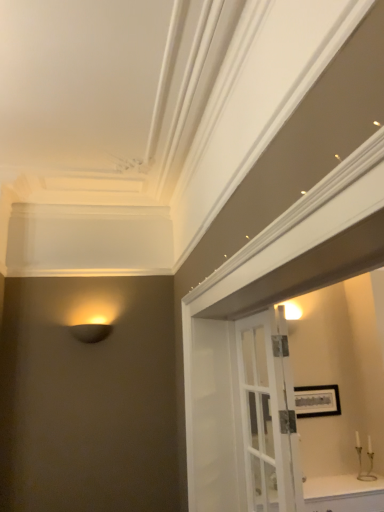
In order to face white glossy cabinet at lower right, should I rotate leftwards or rightwards?

It's best to rotate right around 20.385 degrees.

The height and width of the screenshot is (512, 384). What do you see at coordinates (369, 459) in the screenshot? I see `metallic gold candle holder at lower right` at bounding box center [369, 459].

This screenshot has width=384, height=512. What do you see at coordinates (268, 413) in the screenshot? I see `white glass door at center` at bounding box center [268, 413].

You are a GUI agent. You are given a task and a screenshot of the screen. Output one action in this format:
    pyautogui.click(x=<x>, y=<y>)
    Task: Click on the matte black lamp at left
    
    Given the screenshot: What is the action you would take?
    pyautogui.click(x=91, y=332)

From the image's perspective, between white glossy cabinet at lower right and white glass door at center, which one is located above?

white glass door at center is shown above in the image.

Is white glass door at center inside white glossy cabinet at lower right?

No, white glossy cabinet at lower right does not contain white glass door at center.

Which object is wider, white glossy cabinet at lower right or white glass door at center?

With larger width is white glossy cabinet at lower right.

From a real-world perspective, is white glossy cabinet at lower right positioned over white glass door at center based on gravity?

Actually, white glossy cabinet at lower right is physically below white glass door at center in the real world.

Considering the sizes of objects white glass door at center and matte black lamp at left in the image provided, who is shorter, white glass door at center or matte black lamp at left?

matte black lamp at left.

Is white glass door at center not within matte black lamp at left?

That's correct, white glass door at center is outside of matte black lamp at left.

Locate an element on the screen. The height and width of the screenshot is (512, 384). door lying below the matte black lamp at left (from the image's perspective) is located at coordinates [268, 413].

From the image's perspective, does white glass door at center appear lower than matte black lamp at left?

Correct, white glass door at center appears lower than matte black lamp at left in the image.

From a real-world perspective, is white glossy cabinet at lower right physically above matte black lamp at left?

No, from a real-world perspective, white glossy cabinet at lower right is not over matte black lamp at left

Who is taller, white glossy cabinet at lower right or matte black lamp at left?

white glossy cabinet at lower right.

Considering the positions of objects white glossy cabinet at lower right and matte black lamp at left in the image provided, who is more to the right, white glossy cabinet at lower right or matte black lamp at left?

white glossy cabinet at lower right is more to the right.

Based on the photo, is white glass door at center looking in the opposite direction of white glossy cabinet at lower right?

No, white glossy cabinet at lower right is not at the back of white glass door at center.

Is white glass door at center beside white glossy cabinet at lower right?

They are not placed beside each other.

How different are the orientations of white glass door at center and white glossy cabinet at lower right in degrees?

89.2 degrees.

Considering their positions, is white glass door at center located in front of or behind white glossy cabinet at lower right?

white glass door at center is positioned closer to the viewer than white glossy cabinet at lower right.

Is matte black lamp at left next to metallic gold candle holder at lower right and touching it?

No, matte black lamp at left is not in contact with metallic gold candle holder at lower right.

Which of these two, matte black lamp at left or metallic gold candle holder at lower right, is bigger?

matte black lamp at left.

The image size is (384, 512). Identify the location of lamp in front of the metallic gold candle holder at lower right. (91, 332).

Is metallic gold candle holder at lower right at the left side of white glass door at center?

Incorrect, metallic gold candle holder at lower right is not on the left side of white glass door at center.

Who is smaller, metallic gold candle holder at lower right or white glass door at center?

metallic gold candle holder at lower right is smaller.

Considering the sizes of objects metallic gold candle holder at lower right and white glass door at center in the image provided, who is taller, metallic gold candle holder at lower right or white glass door at center?

Standing taller between the two is white glass door at center.

Is white glass door at center located within metallic gold candle holder at lower right?

No, white glass door at center is not inside metallic gold candle holder at lower right.

Based on the photo, from a real-world perspective, is metallic gold candle holder at lower right beneath matte black lamp at left?

Correct, in the physical world, metallic gold candle holder at lower right is lower than matte black lamp at left.

Locate an element on the screen. Image resolution: width=384 pixels, height=512 pixels. candle holder on the right of matte black lamp at left is located at coordinates (369, 459).

From the image's perspective, does metallic gold candle holder at lower right appear higher than matte black lamp at left?

Actually, metallic gold candle holder at lower right appears below matte black lamp at left in the image.

Measure the distance between metallic gold candle holder at lower right and matte black lamp at left.

A distance of 7.49 feet exists between metallic gold candle holder at lower right and matte black lamp at left.

Image resolution: width=384 pixels, height=512 pixels. In order to click on door to the left of white glossy cabinet at lower right in this screenshot , I will do `click(268, 413)`.

This screenshot has width=384, height=512. What are the coordinates of `door beneath the matte black lamp at left (from a real-world perspective)` in the screenshot? It's located at (268, 413).

When comparing their distances from matte black lamp at left, does metallic gold candle holder at lower right or white glossy cabinet at lower right seem closer?

The object closer to matte black lamp at left is white glossy cabinet at lower right.

Looking at the image, which one is located closer to metallic gold candle holder at lower right, matte black lamp at left or white glossy cabinet at lower right?

white glossy cabinet at lower right is positioned closer to the anchor metallic gold candle holder at lower right.

Considering their positions, is white glass door at center positioned closer to white glossy cabinet at lower right than matte black lamp at left?

white glass door at center is closer to white glossy cabinet at lower right.

Estimate the real-world distances between objects in this image. Which object is closer to metallic gold candle holder at lower right, white glass door at center or matte black lamp at left?

white glass door at center.

Based on their spatial positions, is white glossy cabinet at lower right or matte black lamp at left further from metallic gold candle holder at lower right?

matte black lamp at left is further to metallic gold candle holder at lower right.

Looking at this image, which object lies further to the anchor point white glossy cabinet at lower right, matte black lamp at left or metallic gold candle holder at lower right?

The object further to white glossy cabinet at lower right is matte black lamp at left.

Estimate the real-world distances between objects in this image. Which object is closer to white glass door at center, white glossy cabinet at lower right or metallic gold candle holder at lower right?

white glossy cabinet at lower right is positioned closer to the anchor white glass door at center.

Estimate the real-world distances between objects in this image. Which object is closer to metallic gold candle holder at lower right, white glossy cabinet at lower right or white glass door at center?

Based on the image, white glossy cabinet at lower right appears to be nearer to metallic gold candle holder at lower right.

Find the location of `door between matte black lamp at left and white glossy cabinet at lower right`. door between matte black lamp at left and white glossy cabinet at lower right is located at coordinates (268, 413).

Find the location of a particular element. The image size is (384, 512). cabinetry between matte black lamp at left and metallic gold candle holder at lower right in the horizontal direction is located at coordinates (343, 494).

I want to click on door between matte black lamp at left and metallic gold candle holder at lower right, so click(268, 413).

Identify the location of cabinetry between white glass door at center and metallic gold candle holder at lower right in the front-back direction. (343, 494).